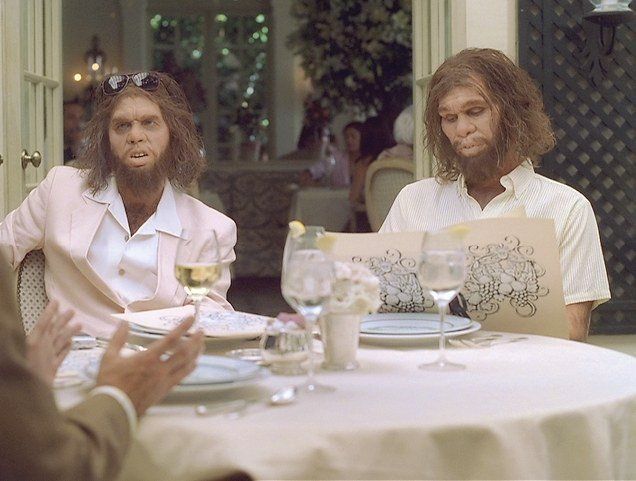
Locate an element on the screen. This screenshot has height=481, width=636. white plate is located at coordinates (420, 324).